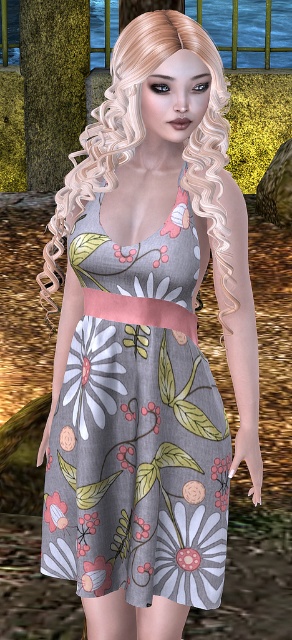
Question: Which object appears closest to the camera in this image?

Choices:
 (A) blonde curly hair at center
 (B) floral fabric flower at lower left
 (C) floral-patterned fabric dress at center

Answer: (A)

Question: Which object appears farthest from the camera in this image?

Choices:
 (A) blonde curly hair at center
 (B) floral fabric flower at lower left
 (C) floral-patterned fabric dress at center

Answer: (B)

Question: From the image, what is the correct spatial relationship of floral-patterned fabric dress at center in relation to blonde curly hair at center?

Choices:
 (A) above
 (B) below

Answer: (B)

Question: Is floral-patterned fabric dress at center below blonde curly hair at center?

Choices:
 (A) yes
 (B) no

Answer: (A)

Question: Among these points, which one is farthest from the camera?

Choices:
 (A) (197, 157)
 (B) (150, 474)
 (C) (65, 522)

Answer: (C)

Question: Is floral-patterned fabric dress at center to the right of floral fabric flower at lower left from the viewer's perspective?

Choices:
 (A) no
 (B) yes

Answer: (B)